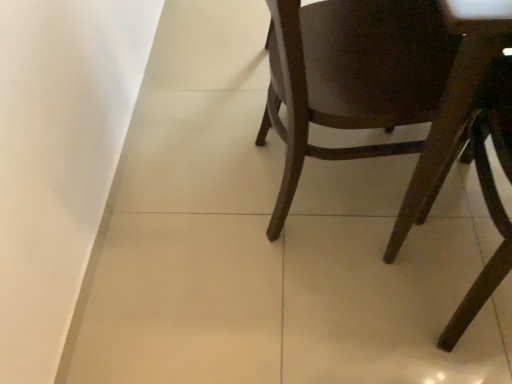
This screenshot has width=512, height=384. In order to click on vacant space in front of dark wood chair at right, acting as the second chair starting from the right in this screenshot , I will do [339, 302].